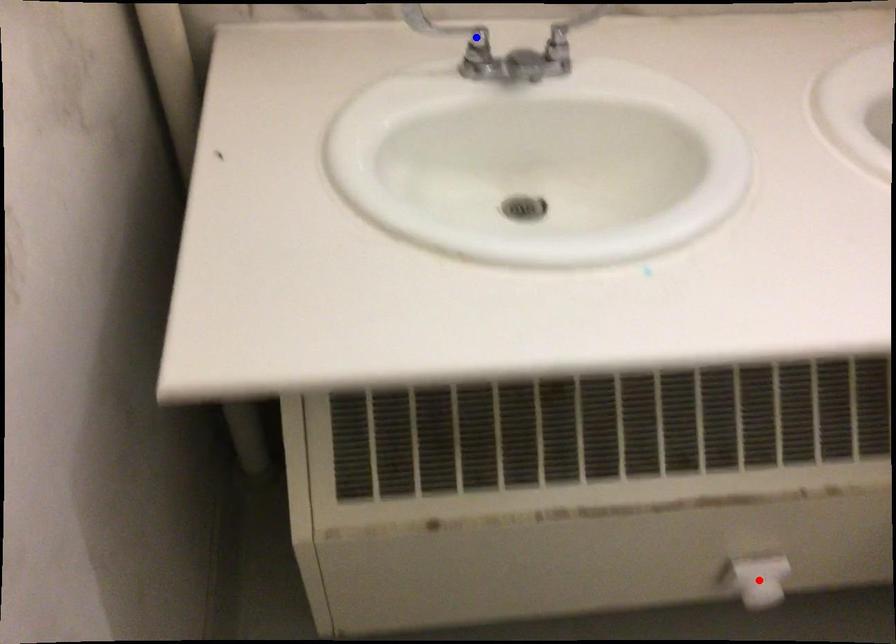
Question: Which of the two points in the image is closer to the camera?

Choices:
 (A) Blue point is closer.
 (B) Red point is closer.

Answer: (A)